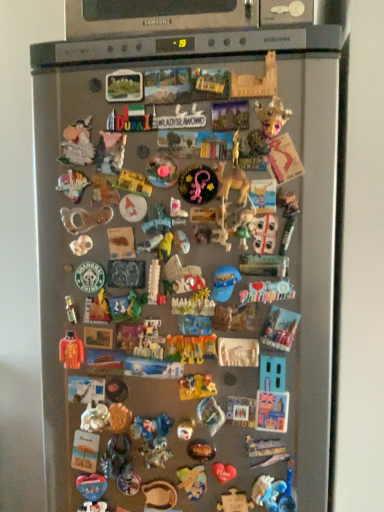
Describe the element at coordinates (234, 502) in the screenshot. I see `wooden puzzle piece at center, placed as the first toy when sorted from bottom to top` at that location.

At what (x,y) coordinates should I click in order to perform the action: click on wooden puzzle piece at center, placed as the first toy when sorted from bottom to top. Please return your answer as a coordinate pair (x, y). This screenshot has height=512, width=384. Looking at the image, I should click on (234, 502).

The image size is (384, 512). What do you see at coordinates (92, 492) in the screenshot?
I see `matte blue heart at center, which is counted as the 30th toy, starting from the top` at bounding box center [92, 492].

Image resolution: width=384 pixels, height=512 pixels. What do you see at coordinates (181, 277) in the screenshot?
I see `wooden puzzle piece at center, which is the 15th toy from top to bottom` at bounding box center [181, 277].

Describe the element at coordinates (97, 308) in the screenshot. I see `metallic gold statue at center, arranged as the fifteenth toy when ordered from the bottom` at that location.

What is the approximate height of wooden lettering at center, which is counted as the second toy, starting from the top?

wooden lettering at center, which is counted as the second toy, starting from the top, is 2.26 inches in height.

Locate an element on the screen. Image resolution: width=384 pixels, height=512 pixels. wooden puzzle piece at center, the 32th toy in the top-to-bottom sequence is located at coordinates (234, 502).

From a real-world perspective, is blue plastic magnet at lower right, acting as the nineteenth toy starting from the top, physically above wooden puzzle piece at center, which is the fifth toy in bottom-to-top order?

Yes, from a real-world perspective, blue plastic magnet at lower right, acting as the nineteenth toy starting from the top, is over wooden puzzle piece at center, which is the fifth toy in bottom-to-top order

Between blue plastic magnet at lower right, placed as the 14th toy when sorted from bottom to top, and wooden puzzle piece at center, which is the fifth toy in bottom-to-top order, which one appears on the right side from the viewer's perspective?

blue plastic magnet at lower right, placed as the 14th toy when sorted from bottom to top, is more to the right.

Which is nearer, (269,324) or (200,490)?

The point (269,324) is in front.

Is the surface of blue plastic magnet at lower right, acting as the nineteenth toy starting from the top, in direct contact with wooden puzzle piece at center, which is the fifth toy in bottom-to-top order?

No, blue plastic magnet at lower right, acting as the nineteenth toy starting from the top, is not beside wooden puzzle piece at center, which is the fifth toy in bottom-to-top order.

In the scene shown: Is the position of blue plastic magnet at lower right, acting as the nineteenth toy starting from the top, less distant than that of wooden bowl at lower center, the 2th toy positioned from the bottom?

That is True.

From the image's perspective, which one is positioned higher, blue plastic magnet at lower right, acting as the nineteenth toy starting from the top, or wooden bowl at lower center, the 2th toy positioned from the bottom?

blue plastic magnet at lower right, acting as the nineteenth toy starting from the top.

At what (x,y) coordinates should I click in order to perform the action: click on the 12th toy directly beneath the blue plastic magnet at lower right, placed as the 14th toy when sorted from bottom to top (from a real-world perspective). Please return your answer as a coordinate pair (x, y). The width and height of the screenshot is (384, 512). Looking at the image, I should click on (159, 495).

Does blue plastic magnet at lower right, placed as the 14th toy when sorted from bottom to top, touch wooden bowl at lower center, the 31th toy in the top-to-bottom sequence?

No, blue plastic magnet at lower right, placed as the 14th toy when sorted from bottom to top, is not with wooden bowl at lower center, the 31th toy in the top-to-bottom sequence.

Between wooden puzzle piece at center, acting as the 28th toy starting from the top, and matte white figurine at center, placed as the 19th toy when sorted from bottom to top, which one has larger size?

Bigger between the two is wooden puzzle piece at center, acting as the 28th toy starting from the top.

In terms of width, does wooden puzzle piece at center, which is the fifth toy in bottom-to-top order, look wider or thinner when compared to matte white figurine at center, placed as the 19th toy when sorted from bottom to top?

wooden puzzle piece at center, which is the fifth toy in bottom-to-top order, is thinner than matte white figurine at center, placed as the 19th toy when sorted from bottom to top.

Is wooden puzzle piece at center, acting as the 28th toy starting from the top, oriented towards matte white figurine at center, placed as the 19th toy when sorted from bottom to top?

No, wooden puzzle piece at center, acting as the 28th toy starting from the top, is not turned towards matte white figurine at center, placed as the 19th toy when sorted from bottom to top.

Is brown plastic camel at center, acting as the 26th toy starting from the bottom, facing towards metallic gold statue at center, arranged as the fifteenth toy when ordered from the bottom?

No, brown plastic camel at center, acting as the 26th toy starting from the bottom, is not facing towards metallic gold statue at center, arranged as the fifteenth toy when ordered from the bottom.

Considering the relative positions of brown plastic camel at center, which is the 7th toy from top to bottom, and metallic gold statue at center, placed as the 18th toy when sorted from top to bottom, in the image provided, is brown plastic camel at center, which is the 7th toy from top to bottom, to the right of metallic gold statue at center, placed as the 18th toy when sorted from top to bottom, from the viewer's perspective?

Yes, brown plastic camel at center, which is the 7th toy from top to bottom, is to the right of metallic gold statue at center, placed as the 18th toy when sorted from top to bottom.

From a real-world perspective, relative to metallic gold statue at center, placed as the 18th toy when sorted from top to bottom, is brown plastic camel at center, acting as the 26th toy starting from the bottom, vertically above or below?

In terms of real-world spatial position, brown plastic camel at center, acting as the 26th toy starting from the bottom, is above metallic gold statue at center, placed as the 18th toy when sorted from top to bottom.

Considering their positions, is brown plastic camel at center, which is the 7th toy from top to bottom, located in front of or behind metallic gold statue at center, arranged as the fifteenth toy when ordered from the bottom?

brown plastic camel at center, which is the 7th toy from top to bottom, is positioned closer to the viewer than metallic gold statue at center, arranged as the fifteenth toy when ordered from the bottom.

Can you confirm if translucent plastic toy at center, which is the eleventh toy in bottom-to-top order, is positioned to the left of metallic crown at upper right, marked as the 30th toy in a bottom-to-top arrangement?

Yes, translucent plastic toy at center, which is the eleventh toy in bottom-to-top order, is to the left of metallic crown at upper right, marked as the 30th toy in a bottom-to-top arrangement.

Can you confirm if translucent plastic toy at center, the 22th toy positioned from the top, is shorter than metallic crown at upper right, marked as the 30th toy in a bottom-to-top arrangement?

Yes, translucent plastic toy at center, the 22th toy positioned from the top, is shorter than metallic crown at upper right, marked as the 30th toy in a bottom-to-top arrangement.

Is translucent plastic toy at center, which is the eleventh toy in bottom-to-top order, touching metallic crown at upper right, marked as the 30th toy in a bottom-to-top arrangement?

No.

Consider the image. Is translucent plastic toy at center, the 22th toy positioned from the top, aimed at metallic crown at upper right, marked as the 30th toy in a bottom-to-top arrangement?

No, translucent plastic toy at center, the 22th toy positioned from the top, is not aimed at metallic crown at upper right, marked as the 30th toy in a bottom-to-top arrangement.

Considering the relative sizes of metallic crown at upper right, which is counted as the 3th toy, starting from the top, and metallic silver toy at center, the fifth toy when ordered from top to bottom, in the image provided, is metallic crown at upper right, which is counted as the 3th toy, starting from the top, taller than metallic silver toy at center, the fifth toy when ordered from top to bottom,?

In fact, metallic crown at upper right, which is counted as the 3th toy, starting from the top, may be shorter than metallic silver toy at center, the fifth toy when ordered from top to bottom.

Do you think metallic crown at upper right, which is counted as the 3th toy, starting from the top, is within metallic silver toy at center, the fifth toy when ordered from top to bottom, or outside of it?

metallic crown at upper right, which is counted as the 3th toy, starting from the top, is not inside metallic silver toy at center, the fifth toy when ordered from top to bottom, it's outside.

From the image's perspective, is metallic crown at upper right, marked as the 30th toy in a bottom-to-top arrangement, below metallic silver toy at center, which is the 28th toy from bottom to top?

Actually, metallic crown at upper right, marked as the 30th toy in a bottom-to-top arrangement, appears above metallic silver toy at center, which is the 28th toy from bottom to top, in the image.

Considering the relative positions of translucent plastic toy at center, acting as the 23th toy starting from the bottom, and wooden puzzle piece at center, acting as the 18th toy starting from the bottom, in the image provided, is translucent plastic toy at center, acting as the 23th toy starting from the bottom, to the left or to the right of wooden puzzle piece at center, acting as the 18th toy starting from the bottom,?

Clearly, translucent plastic toy at center, acting as the 23th toy starting from the bottom, is on the left of wooden puzzle piece at center, acting as the 18th toy starting from the bottom, in the image.

Between point (159, 207) and point (193, 270), which one is positioned in front?

The point (193, 270) is closer to the camera.

Is translucent plastic toy at center, the tenth toy from the top, closer to camera compared to wooden puzzle piece at center, which is the 15th toy from top to bottom?

No, translucent plastic toy at center, the tenth toy from the top, is behind wooden puzzle piece at center, which is the 15th toy from top to bottom.

From a real-world perspective, which toy is the 9th one above the wooden puzzle piece at center, acting as the 28th toy starting from the top? Please provide its 2D coordinates.

[(280, 328)]

Find the location of a particular element. The image size is (384, 512). the 17th toy behind the blue plastic magnet at lower right, acting as the nineteenth toy starting from the top is located at coordinates (159, 495).

Estimate the real-world distances between objects in this image. Which object is further from orange fabric toy at center, the 10th toy positioned from the bottom, white plastic toy at center, which ranks as the eighth toy in top-to-bottom order, or metallic gold statue at center, arranged as the fifteenth toy when ordered from the bottom?

Based on the image, white plastic toy at center, which ranks as the eighth toy in top-to-bottom order, appears to be further to orange fabric toy at center, the 10th toy positioned from the bottom.

Estimate the real-world distances between objects in this image. Which object is further from white plastic toy at center, arranged as the 12th toy when ordered from the bottom, translucent plastic toy at center, the tenth toy from the top, or wooden castle at upper center, arranged as the 32th toy when ordered from the bottom?

Based on the image, wooden castle at upper center, arranged as the 32th toy when ordered from the bottom, appears to be further to white plastic toy at center, arranged as the 12th toy when ordered from the bottom.

Looking at the image, which one is located closer to wooden castle at upper center, arranged as the 32th toy when ordered from the bottom, white plastic magnet at center, the seventeenth toy when ordered from top to bottom, or metallic crown at upper right, which is counted as the 3th toy, starting from the top?

metallic crown at upper right, which is counted as the 3th toy, starting from the top.

Estimate the real-world distances between objects in this image. Which object is closer to translucent plastic toy at center, the tenth toy from the top, wooden puzzle piece at center, acting as the 28th toy starting from the top, or metallic silver toy at center, the fifth toy when ordered from top to bottom?

metallic silver toy at center, the fifth toy when ordered from top to bottom, is positioned closer to the anchor translucent plastic toy at center, the tenth toy from the top.

Looking at the image, which one is located further to orange fabric toy at center, the 10th toy positioned from the bottom, wooden puzzle piece at center, acting as the 28th toy starting from the top, or matte white figurine at center, placed as the 19th toy when sorted from bottom to top?

Among the two, wooden puzzle piece at center, acting as the 28th toy starting from the top, is located further to orange fabric toy at center, the 10th toy positioned from the bottom.

Which object lies nearer to the anchor point wooden puzzle piece at center, which is the 15th toy from top to bottom, matte blue heart at center, the 3th toy when ordered from bottom to top, or white plastic magnet at center, which is counted as the 16th toy, starting from the bottom?

white plastic magnet at center, which is counted as the 16th toy, starting from the bottom, is positioned closer to the anchor wooden puzzle piece at center, which is the 15th toy from top to bottom.

Based on their spatial positions, is white plastic toy at center, the 21th toy viewed from the top, or shiny plastic toy at center, which is counted as the 25th toy, starting from the top, further from white plastic toy at center, which appears as the 20th toy when ordered from the bottom?

shiny plastic toy at center, which is counted as the 25th toy, starting from the top, lies further to white plastic toy at center, which appears as the 20th toy when ordered from the bottom, than the other object.

Which object lies further to the anchor point white plastic toy at center, which ranks as the eighth toy in top-to-bottom order, wooden castle at upper center, arranged as the 32th toy when ordered from the bottom, or matte plastic toy at upper left, acting as the 29th toy starting from the bottom?

The object further to white plastic toy at center, which ranks as the eighth toy in top-to-bottom order, is wooden castle at upper center, arranged as the 32th toy when ordered from the bottom.

The width and height of the screenshot is (384, 512). I want to click on toy between plastic toy at center, the 26th toy positioned from the top, and wooden puzzle piece at center, acting as the 28th toy starting from the top, vertically, so click(185, 429).